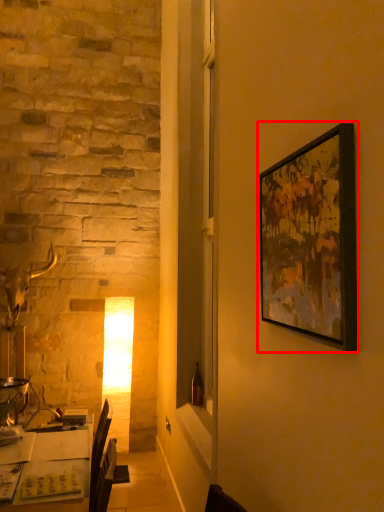
Question: Observing the image, what is the correct spatial positioning of picture frame (annotated by the red box) in reference to table?

Choices:
 (A) right
 (B) left

Answer: (A)